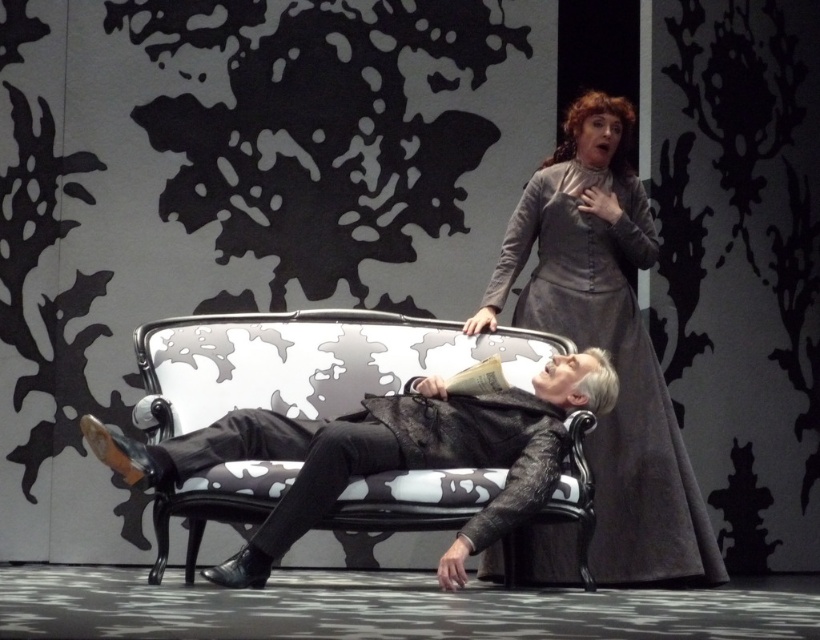
Question: Does gray wool dress at upper right have a greater width compared to black leather pants at center?

Choices:
 (A) yes
 (B) no

Answer: (A)

Question: Does gray wool dress at upper right have a lesser width compared to black leather pants at center?

Choices:
 (A) no
 (B) yes

Answer: (A)

Question: Which point is closer to the camera?

Choices:
 (A) gray wool dress at upper right
 (B) leather jacket at center
 (C) black leather pants at center

Answer: (B)

Question: Which object is closer to the camera taking this photo?

Choices:
 (A) black leather pants at center
 (B) leather jacket at center

Answer: (B)

Question: Which of the following is the farthest from the observer?

Choices:
 (A) (317, 512)
 (B) (380, 424)

Answer: (B)

Question: Is leather jacket at center bigger than black leather pants at center?

Choices:
 (A) no
 (B) yes

Answer: (B)